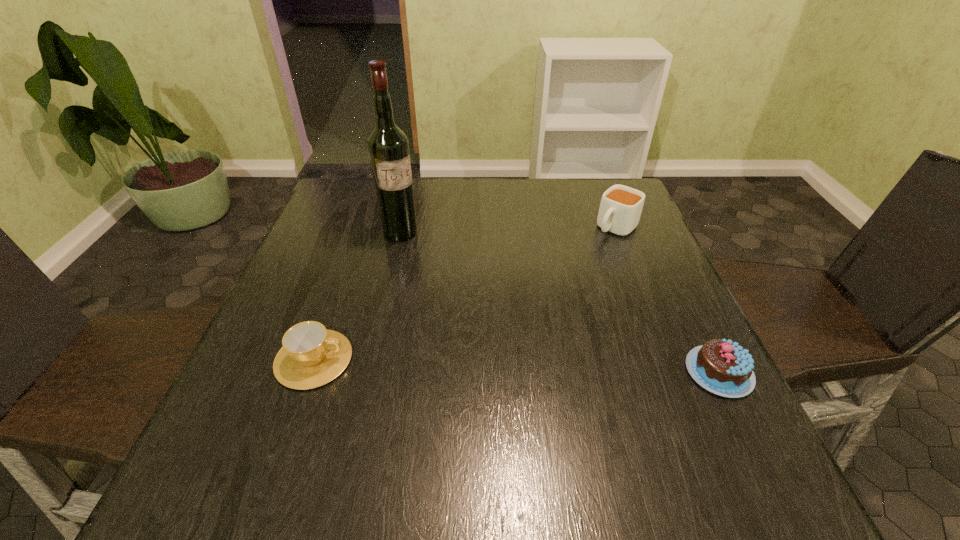
In order to click on vacant space in between the taller cup and the tallest object in this screenshot , I will do (509, 231).

Locate an element on the screen. The height and width of the screenshot is (540, 960). free space between the wine bottle and the chocolate cake is located at coordinates (560, 302).

Find the location of a particular element. Image resolution: width=960 pixels, height=540 pixels. vacant region between the taller cup and the tallest object is located at coordinates (509, 231).

This screenshot has width=960, height=540. I want to click on free spot between the chocolate cake and the second tallest object, so click(x=667, y=300).

Identify the location of vacant space in between the wine bottle and the shorter cup. The width and height of the screenshot is (960, 540). (357, 296).

In order to click on empty space between the chocolate cake and the tallest object in this screenshot , I will do coord(560,302).

Where is `free space between the taller cup and the shorter cup`? This screenshot has width=960, height=540. free space between the taller cup and the shorter cup is located at coordinates (465, 294).

Locate an element on the screen. The height and width of the screenshot is (540, 960). vacant region between the taller cup and the nearer cup is located at coordinates (465, 294).

What are the coordinates of `the third closest object to the wine bottle` in the screenshot? It's located at (721, 366).

Identify which object is the nearest to the farther cup. Please provide its 2D coordinates. Your answer should be formatted as a tuple, i.e. [(x, y)], where the tuple contains the x and y coordinates of a point satisfying the conditions above.

[(721, 366)]